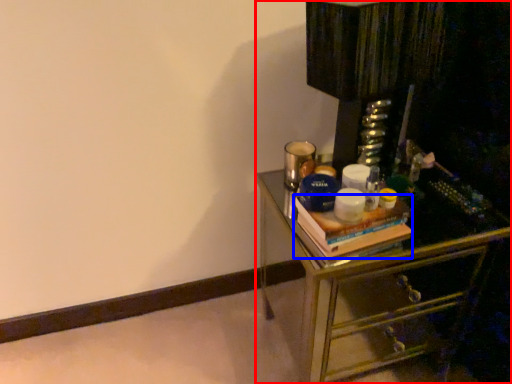
Question: Which object is closer to the camera taking this photo, chest of drawers (highlighted by a red box) or book (highlighted by a blue box)?

Choices:
 (A) chest of drawers
 (B) book

Answer: (A)